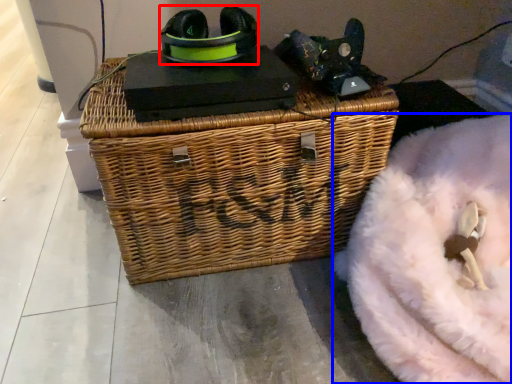
Question: Among these objects, which one is nearest to the camera, shoe (highlighted by a red box) or bean bag chair (highlighted by a blue box)?

Choices:
 (A) shoe
 (B) bean bag chair

Answer: (B)